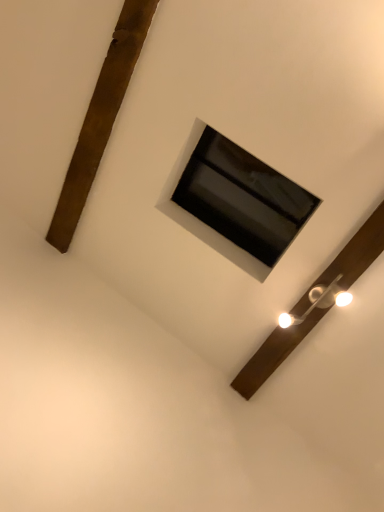
I want to click on white glossy bracket at lower right, so click(272, 355).

This screenshot has width=384, height=512. Describe the element at coordinates (272, 355) in the screenshot. I see `white glossy bracket at lower right` at that location.

Where is `white glossy bracket at lower right`? This screenshot has height=512, width=384. white glossy bracket at lower right is located at coordinates (272, 355).